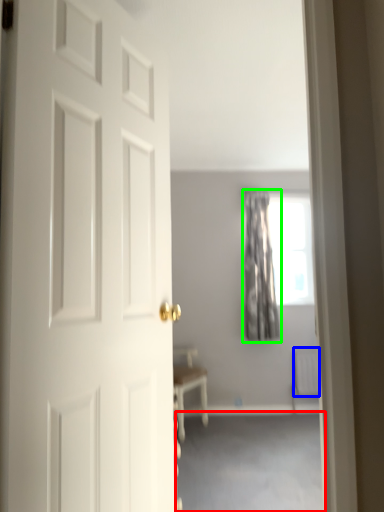
Question: Considering the real-world distances, which object is closest to corridor (highlighted by a red box)? radiator (highlighted by a blue box) or curtain (highlighted by a green box).

Choices:
 (A) radiator
 (B) curtain

Answer: (A)